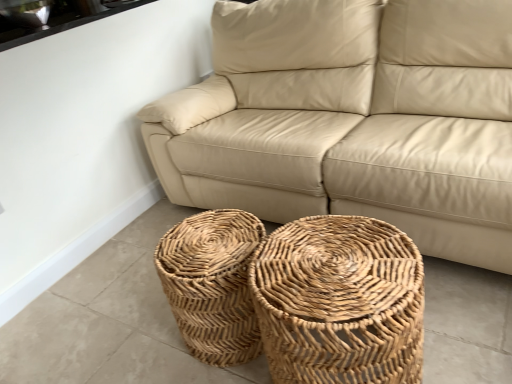
Question: In terms of height, does white glossy window sill at upper left look taller or shorter compared to natural woven basket at center, positioned as the 2th basket in left-to-right order?

Choices:
 (A) short
 (B) tall

Answer: (A)

Question: Considering the positions of white glossy window sill at upper left and natural woven basket at center, positioned as the 2th basket in left-to-right order, in the image, is white glossy window sill at upper left wider or thinner than natural woven basket at center, positioned as the 2th basket in left-to-right order,?

Choices:
 (A) thin
 (B) wide

Answer: (A)

Question: Estimate the real-world distances between objects in this image. Which object is farther from the natural woven baskets at center, the 2th basket in the right-to-left sequence?

Choices:
 (A) beige leather couch at center
 (B) white glossy window sill at upper left
 (C) natural woven basket at center, positioned as the 2th basket in left-to-right order

Answer: (B)

Question: Estimate the real-world distances between objects in this image. Which object is closer to the beige leather couch at center?

Choices:
 (A) natural woven baskets at center, the 2th basket in the right-to-left sequence
 (B) white glossy window sill at upper left
 (C) natural woven basket at center, positioned as the 2th basket in left-to-right order

Answer: (C)